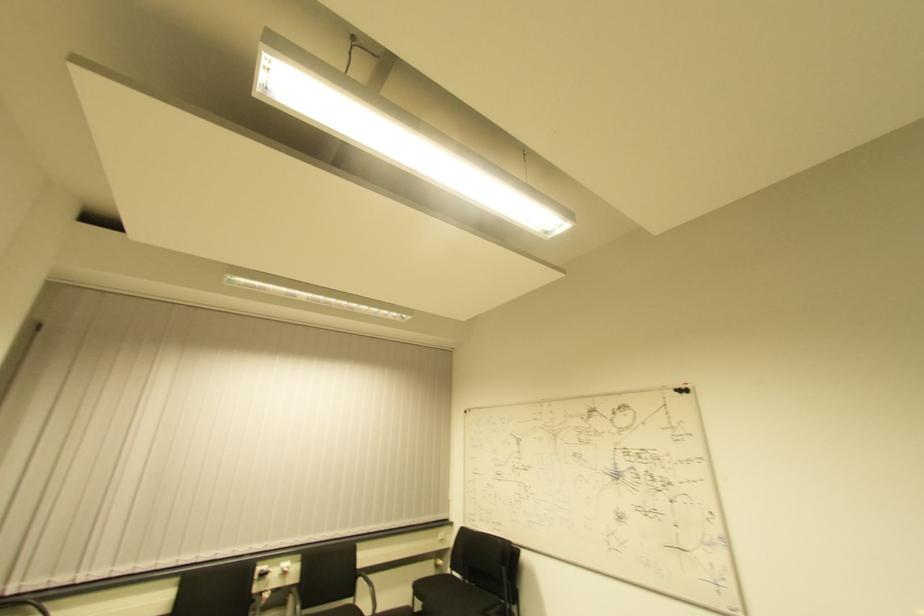
Where is `black chair sitting surface`? The image size is (924, 616). black chair sitting surface is located at coordinates (448, 594).